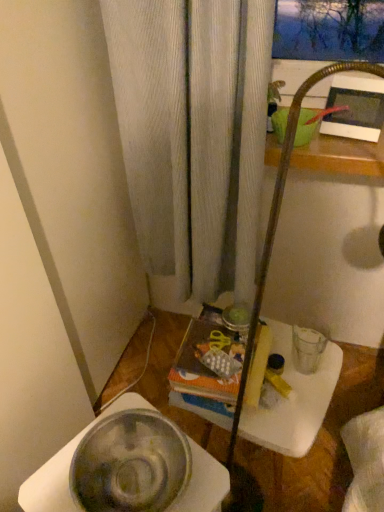
Question: Considering their positions, is metallic silver bowl at lower left, the 1th basin viewed from the left, located in front of or behind clear plastic table at center?

Choices:
 (A) behind
 (B) front

Answer: (B)

Question: From a real-world perspective, relative to clear plastic table at center, is metallic silver bowl at lower left, which appears as the second basin when viewed from the top, vertically above or below?

Choices:
 (A) below
 (B) above

Answer: (B)

Question: Estimate the real-world distances between objects in this image. Which object is closer to the clear plastic table at center?

Choices:
 (A) metallic silver bowl at lower left, acting as the 1th basin starting from the front
 (B) green matte basin at upper right, placed as the 1th basin when sorted from top to bottom

Answer: (A)

Question: Which object is the farthest from the metallic silver bowl at lower left, acting as the 1th basin starting from the front?

Choices:
 (A) green matte basin at upper right, the first basin from the right
 (B) clear plastic table at center

Answer: (A)